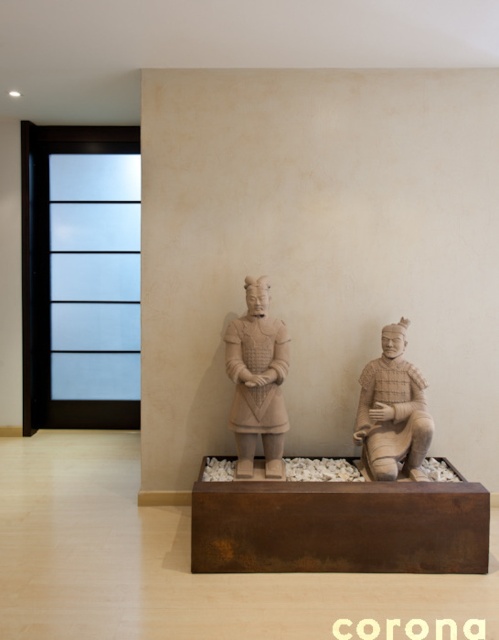
You are a museum guide explaining the arrangement of the two clay warriors in the wooden box. Which of the two warriors, the matte clay warrior at center or the earthy clay warrior at center, is positioned to the left side of the other?

The matte clay warrior at center is positioned to the left of the earthy clay warrior at center.